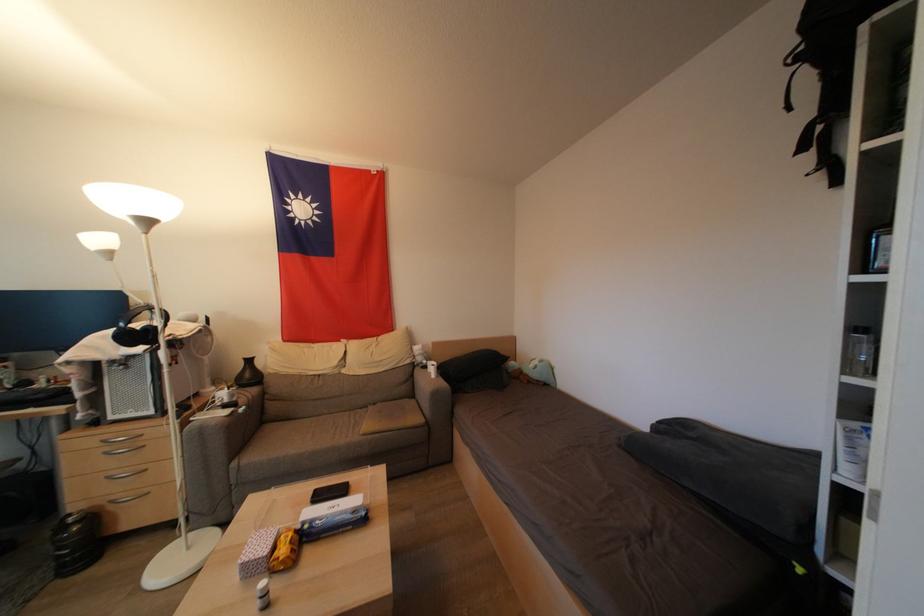
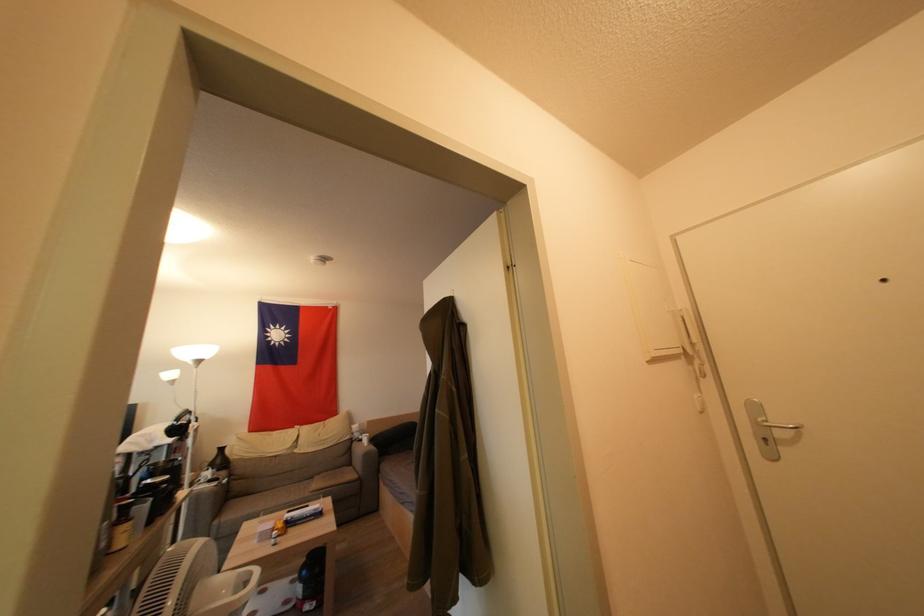
In the second image, find the point that corresponds to point 238,468 in the first image.

(221, 525)